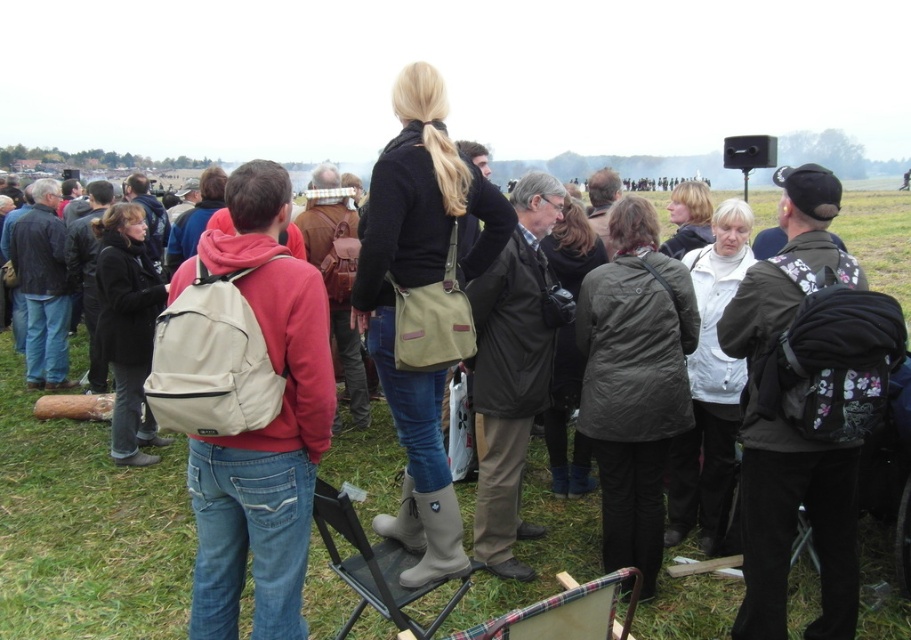
Question: Among these objects, which one is nearest to the camera?

Choices:
 (A) dark green backpack at right
 (B) beige fabric backpack at center
 (C) dark gray jacket at center

Answer: (B)

Question: Where is beige fabric backpack at center located in relation to dark green backpack at right in the image?

Choices:
 (A) above
 (B) below

Answer: (A)

Question: Is dark green backpack at right in front of dark gray jacket at center?

Choices:
 (A) yes
 (B) no

Answer: (A)

Question: Which point is closer to the camera?

Choices:
 (A) rubberized gray folding chair at center
 (B) green grass at center

Answer: (A)

Question: Is beige fabric backpack at center wider than rubberized gray folding chair at center?

Choices:
 (A) no
 (B) yes

Answer: (B)

Question: Which of these objects is positioned closest to the green grass at center?

Choices:
 (A) beige fabric backpack at center
 (B) dark green backpack at right

Answer: (A)